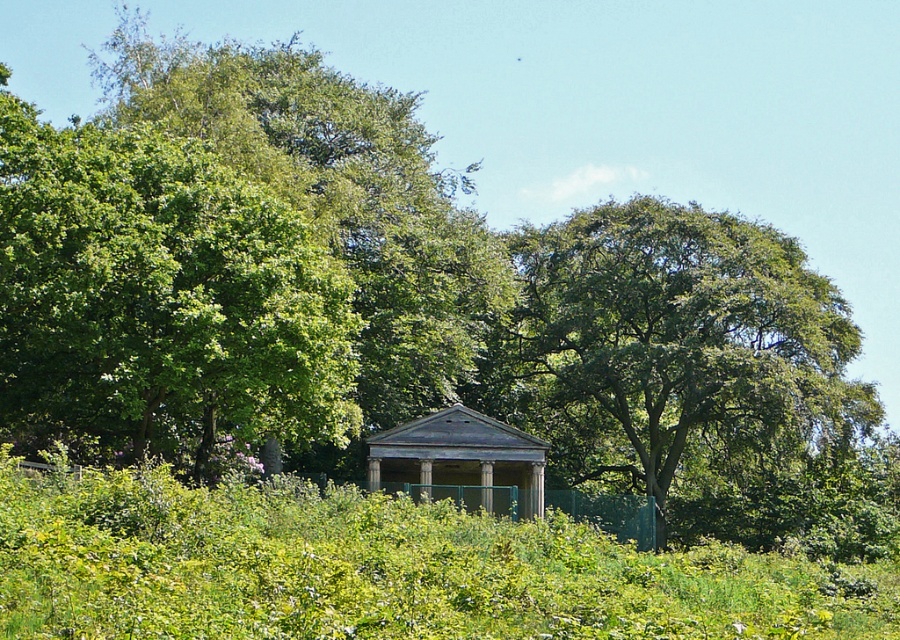
Question: Which point is closer to the camera?

Choices:
 (A) green leafy tree at upper right
 (B) weathered wood gazebo at center

Answer: (B)

Question: Among these points, which one is nearest to the camera?

Choices:
 (A) (461, 445)
 (B) (159, 154)
 (C) (544, 390)

Answer: (B)

Question: Which object is the closest to the green leafy tree at upper left?

Choices:
 (A) weathered wood gazebo at center
 (B) green leafy tree at upper right

Answer: (A)

Question: Does green leafy tree at upper left appear under green leafy tree at upper right?

Choices:
 (A) no
 (B) yes

Answer: (A)

Question: From the image, what is the correct spatial relationship of green leafy tree at upper left in relation to green leafy tree at upper right?

Choices:
 (A) right
 (B) left

Answer: (B)

Question: Observing the image, what is the correct spatial positioning of green leafy tree at upper left in reference to green leafy tree at upper right?

Choices:
 (A) above
 (B) below

Answer: (A)